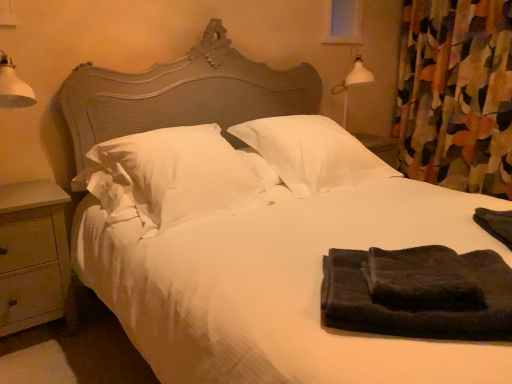
Question: Is point (445, 23) positioned closer to the camera than point (250, 125)?

Choices:
 (A) closer
 (B) farther

Answer: (B)

Question: In the image, is floral fabric curtain at right on the left side or the right side of white soft pillow at center, which appears as the 2th pillow when viewed from the left?

Choices:
 (A) left
 (B) right

Answer: (B)

Question: Based on their relative distances, which object is nearer to the white soft pillow at center, which appears as the first pillow when viewed from the right?

Choices:
 (A) transparent glass window screen at upper center
 (B) floral fabric curtain at right
 (C) white soft pillow at center, the second pillow positioned from the right
 (D) dark green towel at right, acting as the 1th material starting from the right
 (E) black terry towel at lower right, arranged as the first material when viewed from the left

Answer: (C)

Question: Based on their relative distances, which object is nearer to the white soft pillow at center, which appears as the 2th pillow when viewed from the left?

Choices:
 (A) transparent glass window screen at upper center
 (B) black terry towel at lower right, the second material from the right
 (C) floral fabric curtain at right
 (D) white soft pillow at center, the second pillow positioned from the right
 (E) wooden at left

Answer: (D)